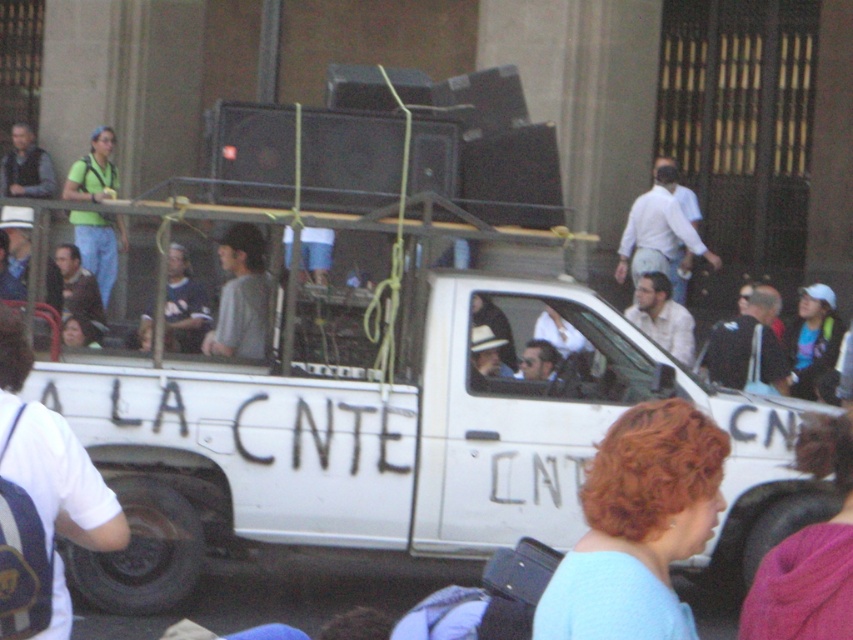
You are standing in front of the white pickup truck at the event. There are two points marked on the truck bed. The first point is at coordinates point (630,268) and the second is at point (173,260). Which point is closer to you?

Point (630,268) is closer to the viewer than point (173,260).

You are a photographer at the event and want to capture both the white shirt at center and the dark blue shirt at center in a single photo. Which shirt should you focus on first to ensure both are in frame?

The white shirt at center is taller than the dark blue shirt at center, so focusing on the white shirt at center first will help ensure both are in frame.

You are a photographer at the event and want to capture both the white matte truck at center and the green matte shirt at upper left in a single photo. Which object should you focus on first to ensure both are in frame?

Since the white matte truck at center is larger than the green matte shirt at upper left, you should focus on the white matte truck at center first to ensure both fit within the frame.